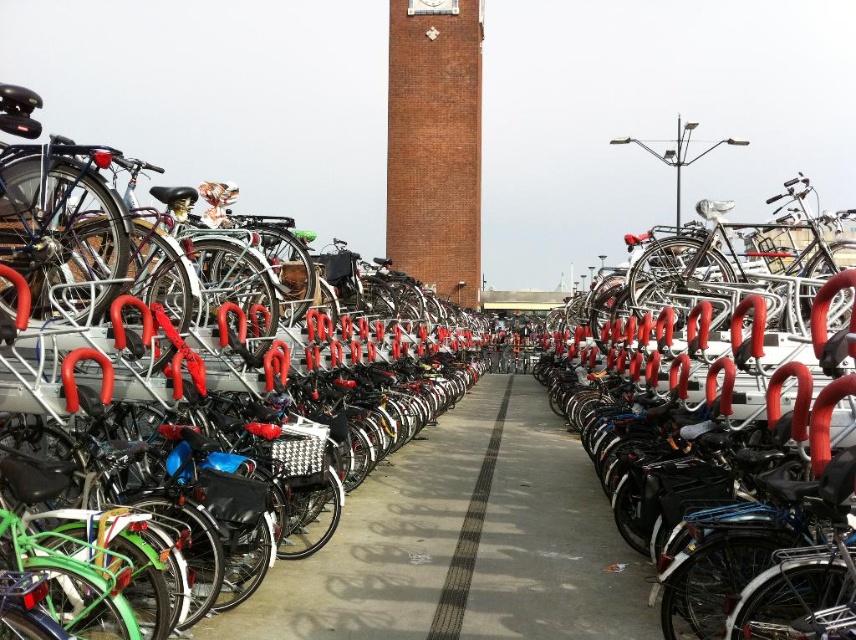
Question: Is shiny black bicycle at right wider than brick clock tower at center?

Choices:
 (A) yes
 (B) no

Answer: (B)

Question: Which of the following is the closest to the observer?

Choices:
 (A) brick clock tower at center
 (B) black rubber line at center
 (C) shiny black bicycle at right

Answer: (C)

Question: Considering the relative positions of brick clock tower at center and black rubber line at center in the image provided, where is brick clock tower at center located with respect to black rubber line at center?

Choices:
 (A) above
 (B) below

Answer: (A)

Question: Which of the following is the closest to the observer?

Choices:
 (A) (431, 218)
 (B) (780, 460)

Answer: (B)

Question: Is shiny black bicycle at right thinner than brick clock tower at center?

Choices:
 (A) no
 (B) yes

Answer: (B)

Question: Among these objects, which one is farthest from the camera?

Choices:
 (A) shiny black bicycle at right
 (B) black rubber line at center
 (C) brick clock tower at center

Answer: (C)